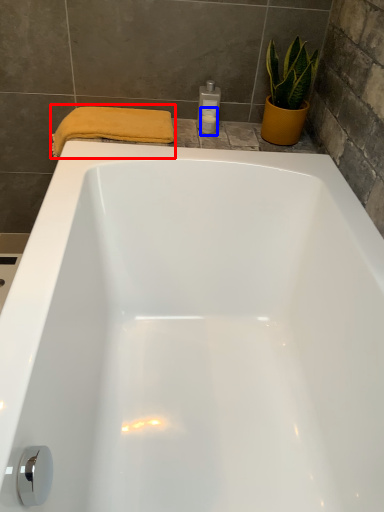
Question: Among these objects, which one is nearest to the camera, bath towel (highlighted by a red box) or toiletry (highlighted by a blue box)?

Choices:
 (A) bath towel
 (B) toiletry

Answer: (A)